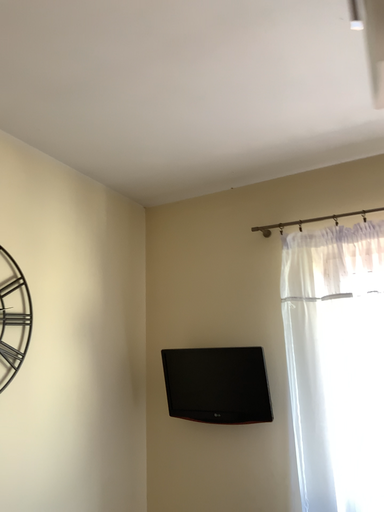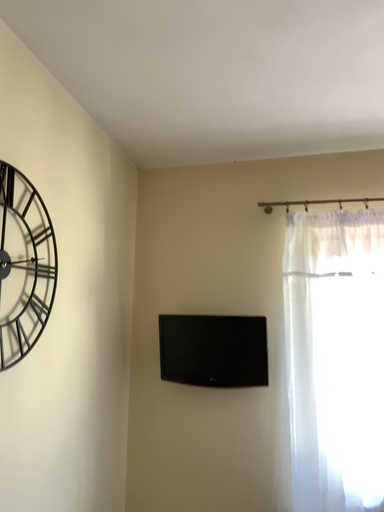
Question: Which way did the camera rotate in the video?

Choices:
 (A) rotated left
 (B) rotated right

Answer: (B)